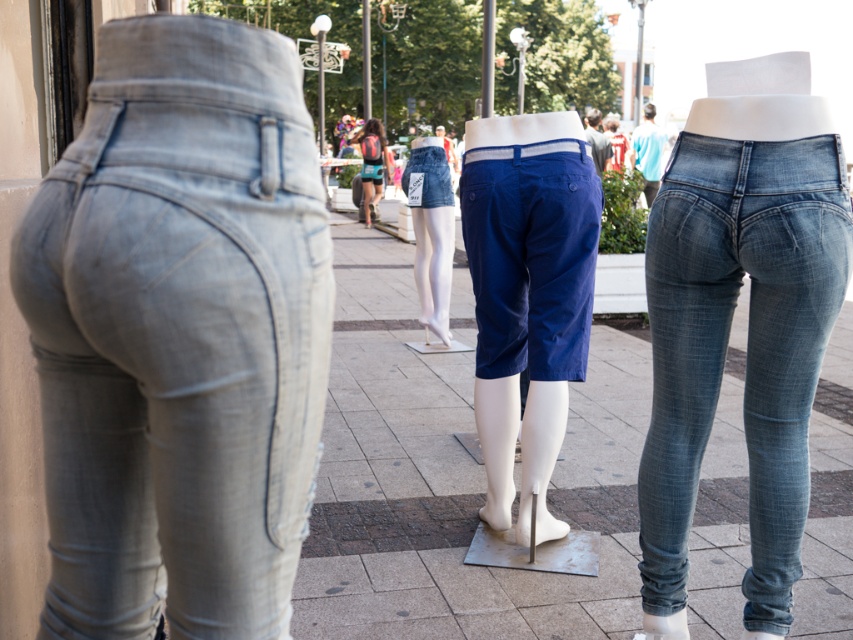
Based on the photo, you are a fashion designer observing the street scene. You notice the blue cotton shorts at center and denim shorts at center. Which of these two items is positioned lower in the image?

The blue cotton shorts at center is positioned below the denim shorts at center, so it is lower in the image.

You are a store manager arranging mannequins for a new clothing display. You have two mannequins in front of you. One is wearing light gray denim jeans at left and the other is wearing blue cotton shorts at center. You need to place them in a way that the one taking up more space is on the right side of the display. Which mannequin should you place on the right side?

The blue cotton shorts at center should be placed on the right side because it occupies more space than the light gray denim jeans at left.